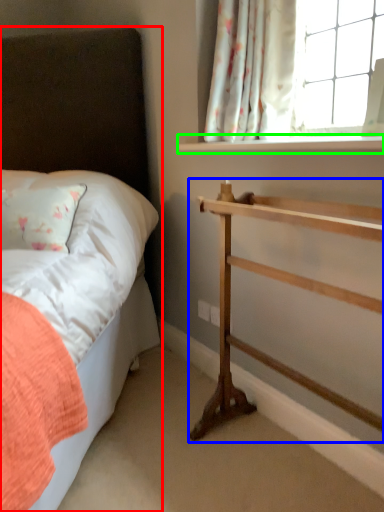
Question: Which object is positioned farthest from bed (highlighted by a red box)? Select from shelf (highlighted by a blue box) and window sill (highlighted by a green box).

Choices:
 (A) shelf
 (B) window sill

Answer: (A)